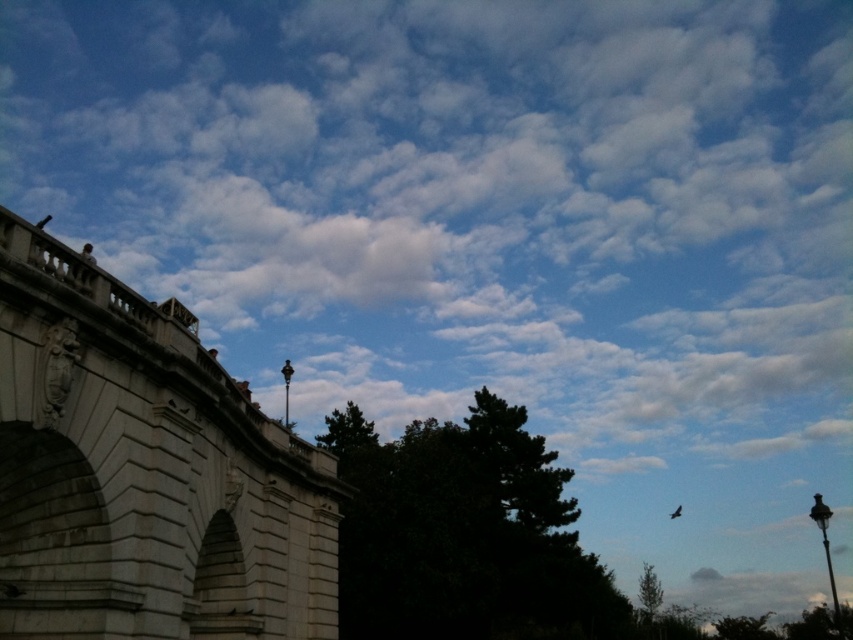
From the picture: Is white stone bridge at left bigger than green leafy tree at lower right?

Incorrect, white stone bridge at left is not larger than green leafy tree at lower right.

Is white stone bridge at left below green leafy tree at lower right?

Incorrect, white stone bridge at left is not positioned below green leafy tree at lower right.

Who is more forward, (252, 435) or (659, 604)?

Point (252, 435) is more forward.

The image size is (853, 640). Find the location of `white stone bridge at left`. white stone bridge at left is located at coordinates (144, 472).

Is white stone bridge at left to the left of brown feathered bird at upper center from the viewer's perspective?

Yes, white stone bridge at left is to the left of brown feathered bird at upper center.

Can you confirm if white stone bridge at left is positioned below brown feathered bird at upper center?

No.

Identify the location of white stone bridge at left. (144, 472).

Which is in front, point (483, 163) or point (669, 515)?

Point (483, 163) is in front.

Looking at this image, is white fluffy cloud at upper center in front of brown feathered bird at upper center?

That is True.

Between point (764, 317) and point (671, 518), which one is positioned behind?

Point (764, 317)

Identify the location of white fluffy cloud at upper center. This screenshot has height=640, width=853. (474, 205).